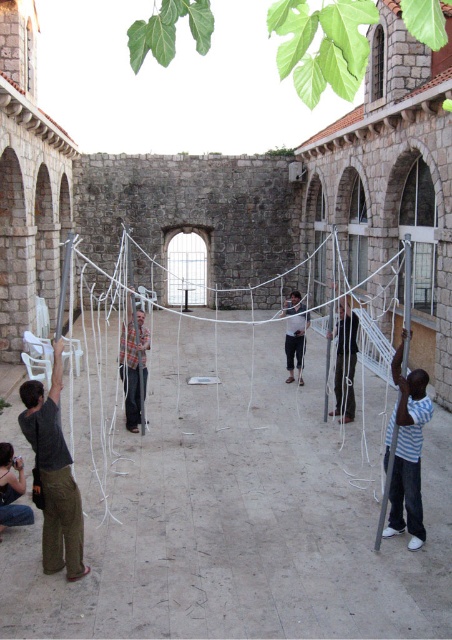
You are a photographer trying to capture the scene of the striped shirt at right and denim jeans at lower left. Since you want to emphasize the size difference between them, which one should you zoom in on more?

The striped shirt at right is larger in size than denim jeans at lower left, so you should zoom in more on the striped shirt at right to emphasize its larger size compared to the denim jeans at lower left.

In the scene shown: You are organizing a small outdoor event in the courtyard. You have a striped shirt at right that you want to hang on the white string net at center. Will the shirt fit across the width of the net?

The white string net at center is wider than the striped shirt at right, so the shirt will fit across the width of the net.

You are standing in the courtyard and want to throw a ball to the striped shirt at right without hitting the white string net at center. Based on their positions, can you do this?

The white string net at center is above the striped shirt at right, so you can throw the ball below the net to reach the striped shirt at right without hitting it.